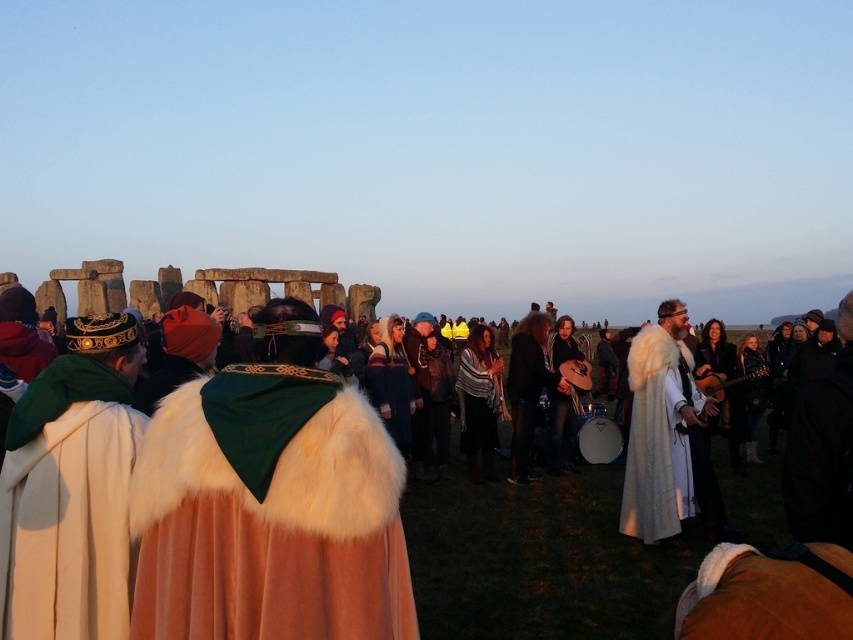
Between white fur cape at center and white fur cape at left, which one appears on the left side from the viewer's perspective?

From the viewer's perspective, white fur cape at left appears more on the left side.

Who is higher up, white fur cape at center or white fur cape at left?

white fur cape at center

Who is more distant from viewer, (157, 600) or (90, 470)?

The point (90, 470) is behind.

Locate an element on the screen. This screenshot has height=640, width=853. white fur cape at center is located at coordinates (270, 502).

Looking at this image, which is above, white fur cloak at center or white fur coat at right?

Positioned higher is white fur coat at right.

Is white fur cloak at center bigger than white fur coat at right?

Yes.

The image size is (853, 640). Describe the element at coordinates (538, 561) in the screenshot. I see `white fur cloak at center` at that location.

Locate an element on the screen. The image size is (853, 640). white fur cloak at center is located at coordinates (538, 561).

In the scene shown: Which is more to the left, white fur cloak at center or white fur cape at left?

white fur cape at left

Between point (561, 595) and point (42, 456), which one is positioned behind?

The point (561, 595) is more distant.

Locate an element on the screen. The image size is (853, 640). white fur cloak at center is located at coordinates (538, 561).